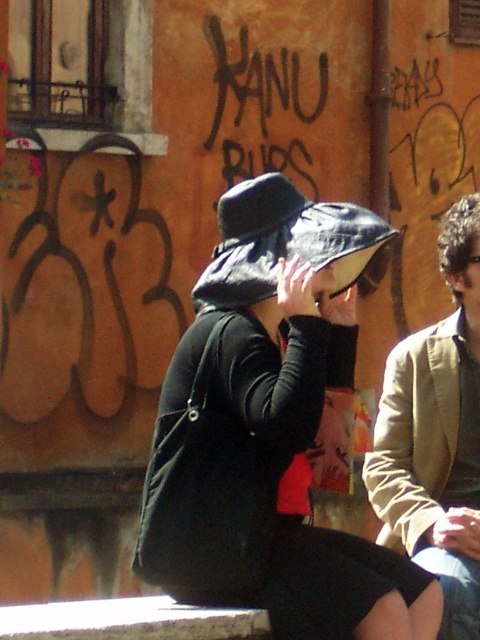
You are an observer standing in front of the weathered wall with graffiti. You notice the tan fabric jacket at right and the matte black hat at upper center. Which object is closer to you?

The tan fabric jacket at right is closer to you because it is in front of the matte black hat at upper center.

You are a photographer wanting to capture a closeup of the matte black hat at upper center and the tan fabric jacket at right. Since you can only focus on one subject at a time, which object should you prioritize to ensure the other is still in the frame?

The tan fabric jacket at right is located below the matte black hat at upper center, so if you focus on the matte black hat at upper center, the tan fabric jacket at right will still be in the frame below it.